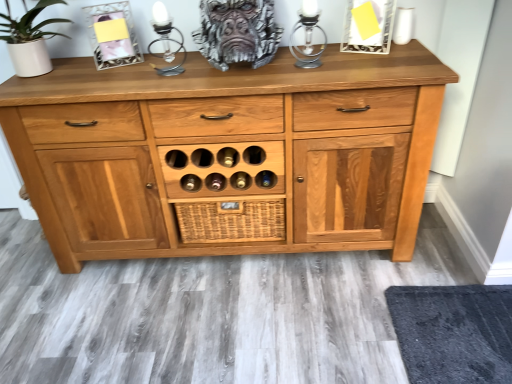
Question: Considering the positions of silver metallic candle holder at upper center, the first candle holder viewed from the right, and woven brown basket at center in the image, is silver metallic candle holder at upper center, the first candle holder viewed from the right, bigger or smaller than woven brown basket at center?

Choices:
 (A) big
 (B) small

Answer: (B)

Question: Looking at their shapes, would you say silver metallic candle holder at upper center, the second candle holder viewed from the left, is wider or thinner than woven brown basket at center?

Choices:
 (A) thin
 (B) wide

Answer: (B)

Question: Estimate the real-world distances between objects in this image. Which object is closer to the black textured mat at lower right?

Choices:
 (A) metallic silver candle holder at upper center, which is counted as the 2th candle holder, starting from the right
 (B) silver metallic candle holder at upper center, the second candle holder viewed from the left
 (C) woven brown basket at center

Answer: (C)

Question: Considering the real-world distances, which object is closest to the woven brown basket at center?

Choices:
 (A) black textured mat at lower right
 (B) silver metallic candle holder at upper center, the first candle holder viewed from the right
 (C) metallic silver candle holder at upper center, which is counted as the 2th candle holder, starting from the right

Answer: (C)